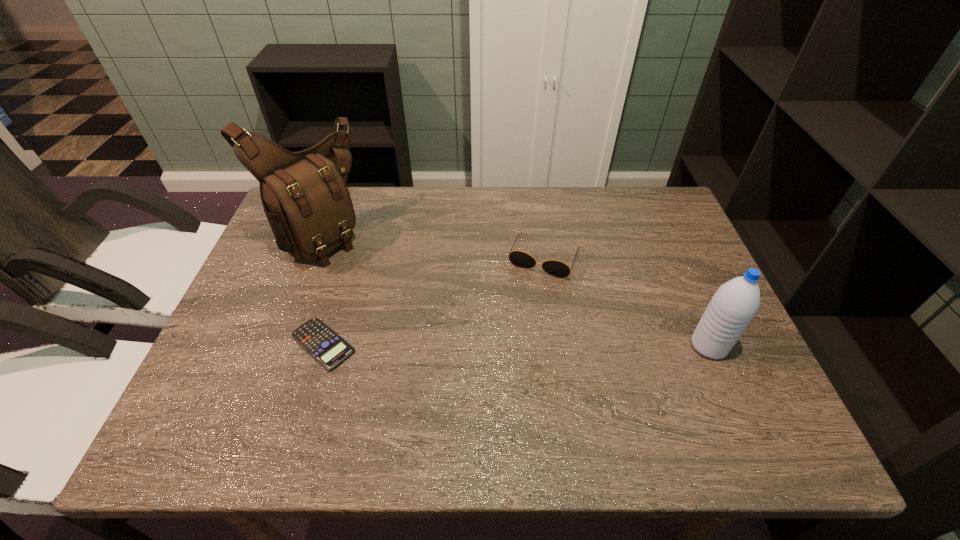
What are the coordinates of `free space that satisfies the following two spatial constraints: 1. on the front side of the tallest object; 2. on the left side of the water bottle` in the screenshot? It's located at (276, 346).